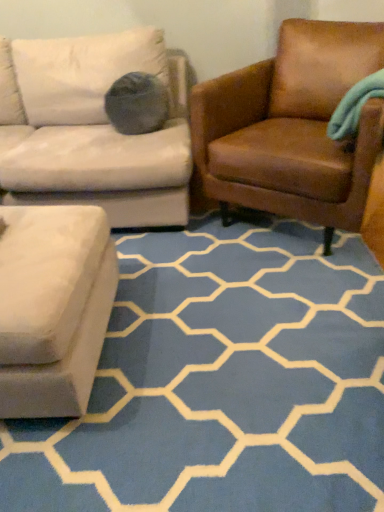
Question: Does brown leather chair at right come in front of blue carpet at lower center?

Choices:
 (A) no
 (B) yes

Answer: (A)

Question: Are brown leather chair at right and blue carpet at lower center far apart?

Choices:
 (A) no
 (B) yes

Answer: (A)

Question: Considering the relative sizes of brown leather chair at right and blue carpet at lower center in the image provided, is brown leather chair at right wider than blue carpet at lower center?

Choices:
 (A) yes
 (B) no

Answer: (B)

Question: Is brown leather chair at right further to the viewer compared to blue carpet at lower center?

Choices:
 (A) yes
 (B) no

Answer: (A)

Question: Is blue carpet at lower center at the back of brown leather chair at right?

Choices:
 (A) no
 (B) yes

Answer: (A)

Question: From a real-world perspective, does brown leather chair at right stand above blue carpet at lower center?

Choices:
 (A) yes
 (B) no

Answer: (A)

Question: Is blue carpet at lower center closer to camera compared to brown leather chair at right?

Choices:
 (A) no
 (B) yes

Answer: (B)

Question: Is blue carpet at lower center far away from brown leather chair at right?

Choices:
 (A) yes
 (B) no

Answer: (B)

Question: Considering the relative sizes of blue carpet at lower center and brown leather chair at right in the image provided, is blue carpet at lower center bigger than brown leather chair at right?

Choices:
 (A) no
 (B) yes

Answer: (A)

Question: Does blue carpet at lower center have a lesser width compared to brown leather chair at right?

Choices:
 (A) yes
 (B) no

Answer: (B)

Question: From a real-world perspective, is blue carpet at lower center on top of brown leather chair at right?

Choices:
 (A) no
 (B) yes

Answer: (A)

Question: Is blue carpet at lower center turned away from brown leather chair at right?

Choices:
 (A) yes
 (B) no

Answer: (B)

Question: From a real-world perspective, relative to blue carpet at lower center, is brown leather chair at right vertically above or below?

Choices:
 (A) below
 (B) above

Answer: (B)